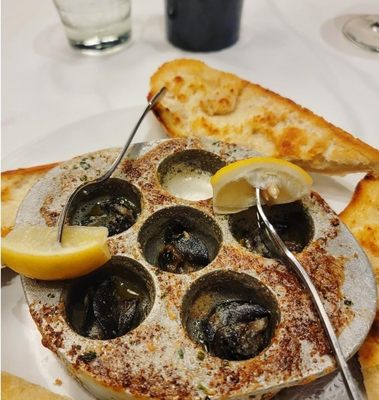
Image resolution: width=379 pixels, height=400 pixels. I want to click on base of wine glass, so click(x=364, y=33).